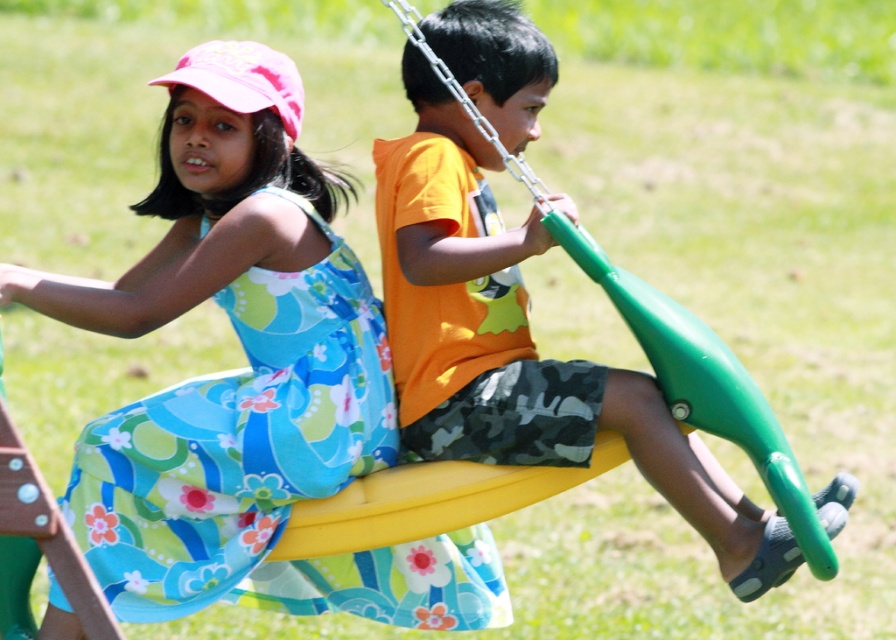
You are a parent watching your children play in the backyard. You see the floral fabric dress at left and the green rubber swing at center. Which object is closer to the ground?

The floral fabric dress at left is positioned under the green rubber swing at center, so the floral fabric dress at left is closer to the ground.

You are a photographer trying to capture a photo of the children playing on the swing set. You want to ensure that both the floral fabric dress at left and the green rubber swing at center are clearly visible in your shot. Based on their heights, which object should you focus on first to ensure proper focus?

The floral fabric dress at left is shorter than the green rubber swing at center, so you should focus on the green rubber swing at center first since it is taller and will require more attention to capture details properly.

You are a photographer trying to capture both the floral fabric dress at left and the green rubber swing at center in a single frame. Based on their sizes, which object should you focus on to ensure both fit in the shot?

Since the floral fabric dress at left is narrower than the green rubber swing at center, you should focus on the green rubber swing at center to ensure both fit in the shot.